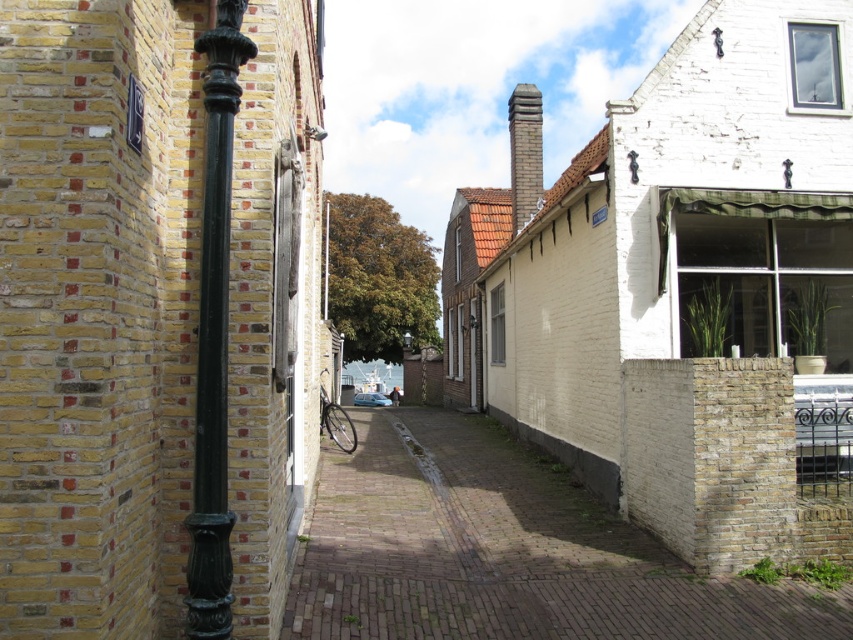
Who is more forward, (577, 579) or (227, 116)?

Point (227, 116) is in front.

Does brick paved alley at center appear on the right side of green patinated metal pole at left?

Yes, brick paved alley at center is to the right of green patinated metal pole at left.

Where is `brick paved alley at center`? The image size is (853, 640). brick paved alley at center is located at coordinates (503, 552).